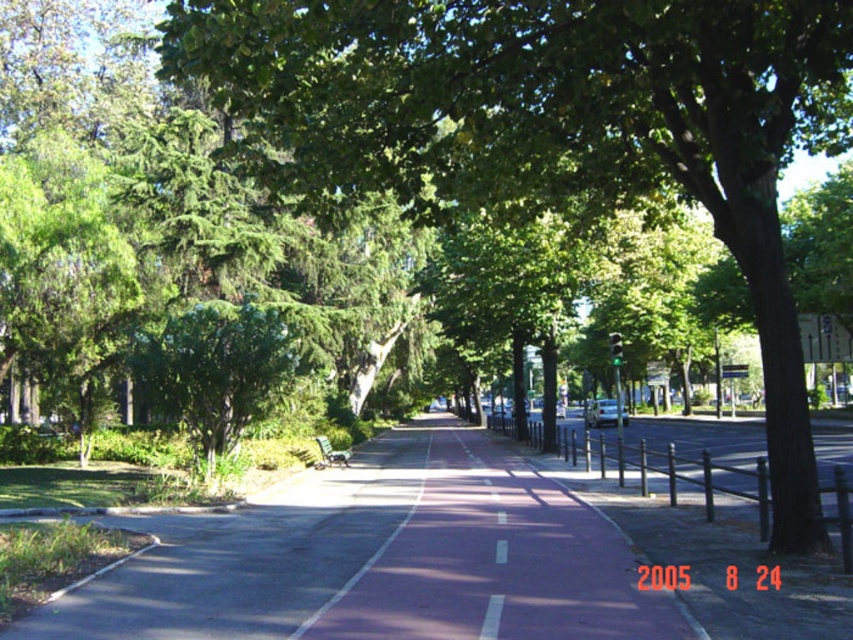
Question: Can you confirm if green leafy tree at center is thinner than pink asphalt path at center?

Choices:
 (A) yes
 (B) no

Answer: (B)

Question: Which point is farther to the camera?

Choices:
 (A) pink asphalt path at center
 (B) green leafy tree at center

Answer: (B)

Question: Is green leafy tree at center to the left of pink asphalt path at center from the viewer's perspective?

Choices:
 (A) yes
 (B) no

Answer: (B)

Question: Is green leafy tree at center further to camera compared to pink asphalt path at center?

Choices:
 (A) yes
 (B) no

Answer: (A)

Question: Which object appears closest to the camera in this image?

Choices:
 (A) pink asphalt path at center
 (B) green leafy tree at center

Answer: (A)